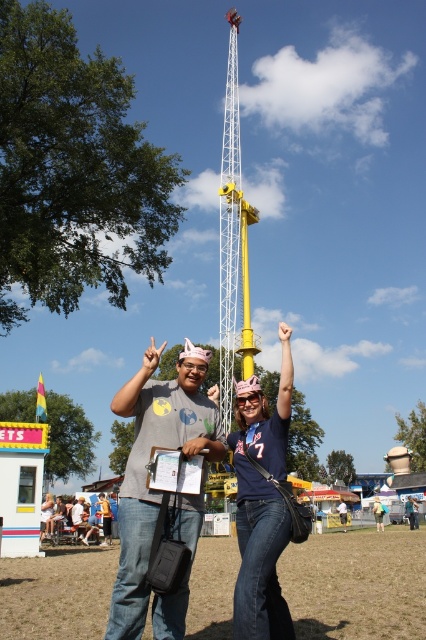
Consider the image. You are a photographer trying to capture a wide shot of the denim jeans at center and the denim jeans at lower center. Given that your camera has a maximum focus range of 30 meters, will you be able to capture both subjects clearly in the same frame?

The distance between the denim jeans at center and the denim jeans at lower center is 26.18 meters. Since this distance is within the camera maximum focus range of 30 meters, both subjects can be captured clearly in the same frame.

You are planning to set up a new attraction between the denim jeans at center and the yellow metallic tower at center. Given that the minimum required space for the attraction is 80 meters, will there be enough space between them?

The denim jeans at center and yellow metallic tower at center are 100.00 meters apart from each other, so yes, there is enough space between them to accommodate the new attraction requiring 80 meters.